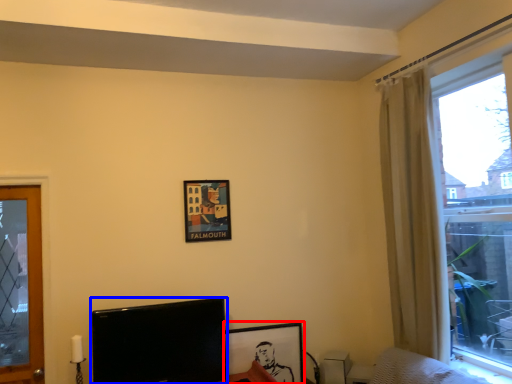
Question: Which object appears closest to the camera in this image, picture frame (highlighted by a red box) or television (highlighted by a blue box)?

Choices:
 (A) picture frame
 (B) television

Answer: (B)